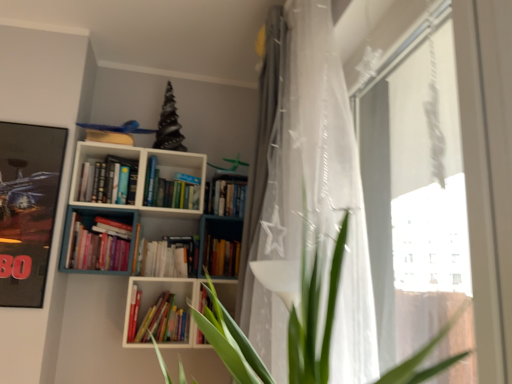
Locate an element on the screen. The image size is (512, 384). white sheer curtain at upper center, arranged as the 1th curtain when viewed from the back is located at coordinates (261, 193).

Measure the distance between hardcover book at center, the 2th book positioned from the bottom, and camera.

hardcover book at center, the 2th book positioned from the bottom, and camera are 7.98 feet apart.

What do you see at coordinates (108, 181) in the screenshot?
I see `hardcover books at center-left, which appears as the fourth book when ordered from the bottom` at bounding box center [108, 181].

Measure the distance between hardcover books at center-left, the first book in the top-to-bottom sequence, and camera.

hardcover books at center-left, the first book in the top-to-bottom sequence, is 2.36 meters from camera.

Consider the image. Measure the distance between point (190, 291) and camera.

A distance of 2.45 meters exists between point (190, 291) and camera.

What do you see at coordinates (229, 198) in the screenshot?
I see `hardcover books at center, the second book from the top` at bounding box center [229, 198].

The image size is (512, 384). I want to click on transparent plastic curtain at right, so click(409, 165).

Based on the photo, which is more to the right, hardcover book at center, arranged as the third book when viewed from the top, or metallic glossy picture frame at left?

hardcover book at center, arranged as the third book when viewed from the top.

Which object is wider, hardcover book at center, the 2th book positioned from the bottom, or metallic glossy picture frame at left?

hardcover book at center, the 2th book positioned from the bottom, is wider.

Who is bigger, hardcover book at center, arranged as the third book when viewed from the top, or metallic glossy picture frame at left?

Bigger between the two is metallic glossy picture frame at left.

Can you tell me how much hardcover book at center, arranged as the third book when viewed from the top, and metallic glossy picture frame at left differ in facing direction?

The facing directions of hardcover book at center, arranged as the third book when viewed from the top, and metallic glossy picture frame at left are 3.28 degrees apart.

Considering the sizes of objects white sheer curtain at center, the second curtain viewed from the back, and metallic glossy picture frame at left in the image provided, who is thinner, white sheer curtain at center, the second curtain viewed from the back, or metallic glossy picture frame at left?

metallic glossy picture frame at left is thinner.

How far apart are white sheer curtain at center, placed as the 1th curtain when sorted from front to back, and metallic glossy picture frame at left?

1.31 meters.

Looking at this image, is white sheer curtain at center, the second curtain viewed from the back, aimed at metallic glossy picture frame at left?

No, white sheer curtain at center, the second curtain viewed from the back, is not facing towards metallic glossy picture frame at left.

How different are the orientations of white sheer curtain at center, the second curtain viewed from the back, and metallic glossy picture frame at left in degrees?

There is a 86.3-degree angle between the facing directions of white sheer curtain at center, the second curtain viewed from the back, and metallic glossy picture frame at left.

From a real-world perspective, is transparent plastic curtain at right over hardcover books at center, the 2th book from the right?

No, from a real-world perspective, transparent plastic curtain at right is not above hardcover books at center, the 2th book from the right.

From the image's perspective, relative to hardcover books at center, marked as the 3th book in a left-to-right arrangement, is transparent plastic curtain at right above or below?

Based on their image positions, transparent plastic curtain at right is located above hardcover books at center, marked as the 3th book in a left-to-right arrangement.

Between point (451, 275) and point (224, 185), which one is positioned behind?

Point (224, 185)

Is transparent plastic curtain at right positioned far away from hardcover books at center, marked as the 3th book in a left-to-right arrangement?

transparent plastic curtain at right is far away from hardcover books at center, marked as the 3th book in a left-to-right arrangement.

From the image's perspective, is hardcover books at center-left, which appears as the 1th book when viewed from the left, above or below metallic glossy picture frame at left?

hardcover books at center-left, which appears as the 1th book when viewed from the left, is situated higher than metallic glossy picture frame at left in the image.

From a real-world perspective, count 2nd books upward from the metallic glossy picture frame at left and point to it. Please provide its 2D coordinates.

[(108, 181)]

From a real-world perspective, which is physically above, hardcover books at center-left, the first book in the top-to-bottom sequence, or metallic glossy picture frame at left?

From a 3D spatial view, hardcover books at center-left, the first book in the top-to-bottom sequence, is above.

Is hardcover books at center-left, which appears as the fourth book when ordered from the bottom, smaller than metallic glossy picture frame at left?

Indeed, hardcover books at center-left, which appears as the fourth book when ordered from the bottom, has a smaller size compared to metallic glossy picture frame at left.

From the image's perspective, is hardcover book at center, the 4th book when ordered from top to bottom, located above hardcover books at center-left, which appears as the 1th book when viewed from the left?

Incorrect, from the image's perspective, hardcover book at center, the 4th book when ordered from top to bottom, is lower than hardcover books at center-left, which appears as the 1th book when viewed from the left.

In the image, is hardcover book at center, the 4th book when ordered from top to bottom, positioned in front of or behind hardcover books at center-left, the first book in the top-to-bottom sequence?

hardcover book at center, the 4th book when ordered from top to bottom, is positioned closer to the viewer than hardcover books at center-left, the first book in the top-to-bottom sequence.

Is hardcover book at center, placed as the first book when sorted from bottom to top, positioned with its back to hardcover books at center-left, which appears as the 1th book when viewed from the left?

No, hardcover books at center-left, which appears as the 1th book when viewed from the left, is not at the back of hardcover book at center, placed as the first book when sorted from bottom to top.

Which is more to the left, hardcover book at center, which is the second book in left-to-right order, or hardcover books at center-left, the first book in the top-to-bottom sequence?

hardcover books at center-left, the first book in the top-to-bottom sequence, is more to the left.

In the scene shown: Considering their positions, is white sheer curtain at upper center, arranged as the 1th curtain when viewed from the back, located in front of or behind hardcover books at center-left, which appears as the fourth book when ordered from the bottom?

Clearly, white sheer curtain at upper center, arranged as the 1th curtain when viewed from the back, is in front of hardcover books at center-left, which appears as the fourth book when ordered from the bottom.

From the image's perspective, is white sheer curtain at upper center, arranged as the 1th curtain when viewed from the back, over hardcover books at center-left, which appears as the fourth book when ordered from the bottom?

Yes, from the image's perspective, white sheer curtain at upper center, arranged as the 1th curtain when viewed from the back, is above hardcover books at center-left, which appears as the fourth book when ordered from the bottom.

Which of these two, white sheer curtain at upper center, arranged as the 1th curtain when viewed from the back, or hardcover books at center-left, which appears as the fourth book when ordered from the bottom, stands shorter?

hardcover books at center-left, which appears as the fourth book when ordered from the bottom.

Could you measure the distance between hardcover book at center, which is the second book in left-to-right order, and hardcover books at center, the second book from the top?

hardcover book at center, which is the second book in left-to-right order, is 26.10 inches from hardcover books at center, the second book from the top.

Is hardcover book at center, arranged as the third book when viewed from the right, turned away from hardcover books at center, marked as the 3th book in a left-to-right arrangement?

hardcover book at center, arranged as the third book when viewed from the right, does not have its back to hardcover books at center, marked as the 3th book in a left-to-right arrangement.

From a real-world perspective, is hardcover book at center, placed as the first book when sorted from bottom to top, over hardcover books at center, marked as the 3th book in a left-to-right arrangement?

No, from a real-world perspective, hardcover book at center, placed as the first book when sorted from bottom to top, is not above hardcover books at center, marked as the 3th book in a left-to-right arrangement.

Where is `picture frame that is above the hardcover book at center, which is the first book from right to left (from a real-world perspective)`? Image resolution: width=512 pixels, height=384 pixels. picture frame that is above the hardcover book at center, which is the first book from right to left (from a real-world perspective) is located at coordinates (27, 208).

Locate an element on the screen. This screenshot has width=512, height=384. the 2nd curtain counting from the right side of the metallic glossy picture frame at left is located at coordinates (313, 201).

Estimate the real-world distances between objects in this image. Which object is closer to hardcover book at center, placed as the first book when sorted from bottom to top, hardcover books at center-left, which appears as the 1th book when viewed from the left, or transparent plastic curtain at right?

Based on the image, hardcover books at center-left, which appears as the 1th book when viewed from the left, appears to be nearer to hardcover book at center, placed as the first book when sorted from bottom to top.

When comparing their distances from white matte bookcase at upper center, does transparent plastic curtain at right or hardcover books at center, the 2th book from the right, seem closer?

Among the two, hardcover books at center, the 2th book from the right, is located nearer to white matte bookcase at upper center.

Based on their spatial positions, is white sheer curtain at upper center, the second curtain in the front-to-back sequence, or white sheer curtain at center, placed as the 1th curtain when sorted from front to back, closer to white matte bookcase at upper center?

white sheer curtain at upper center, the second curtain in the front-to-back sequence.

Looking at the image, which one is located closer to white matte bookcase at upper center, metallic glossy picture frame at left or hardcover book at center, the 2th book positioned from the bottom?

metallic glossy picture frame at left lies closer to white matte bookcase at upper center than the other object.

Considering their positions, is metallic glossy picture frame at left positioned further to white sheer curtain at center, placed as the 1th curtain when sorted from front to back, than hardcover books at center, the second book from the top?

metallic glossy picture frame at left is positioned further to the anchor white sheer curtain at center, placed as the 1th curtain when sorted from front to back.

From the image, which object appears to be farther from transparent plastic curtain at right, hardcover books at center, marked as the 3th book in a left-to-right arrangement, or metallic glossy picture frame at left?

metallic glossy picture frame at left.

Looking at the image, which one is located closer to white sheer curtain at upper center, the second curtain in the front-to-back sequence, metallic glossy picture frame at left or white matte bookcase at upper center?

white matte bookcase at upper center.

Looking at the image, which one is located closer to hardcover book at center, arranged as the third book when viewed from the top, white sheer curtain at upper center, arranged as the 1th curtain when viewed from the back, or hardcover books at center, marked as the 3th book in a bottom-to-top arrangement?

Based on the image, hardcover books at center, marked as the 3th book in a bottom-to-top arrangement, appears to be nearer to hardcover book at center, arranged as the third book when viewed from the top.

Locate an element on the screen. This screenshot has width=512, height=384. picture frame located between white sheer curtain at center, placed as the 1th curtain when sorted from front to back, and hardcover book at center, placed as the first book when sorted from bottom to top, in the depth direction is located at coordinates (27, 208).

Identify the location of bookcase located between transparent plastic curtain at right and hardcover books at center-left, the first book in the top-to-bottom sequence, in the depth direction. (142, 270).

Find the location of `curtain located between metallic glossy picture frame at left and white sheer curtain at center, placed as the 1th curtain when sorted from front to back, in the left-right direction`. curtain located between metallic glossy picture frame at left and white sheer curtain at center, placed as the 1th curtain when sorted from front to back, in the left-right direction is located at coordinates (261, 193).

The width and height of the screenshot is (512, 384). In order to click on curtain between white sheer curtain at center, the second curtain viewed from the back, and hardcover book at center, arranged as the 4th book when viewed from the left, from front to back in this screenshot , I will do `click(261, 193)`.